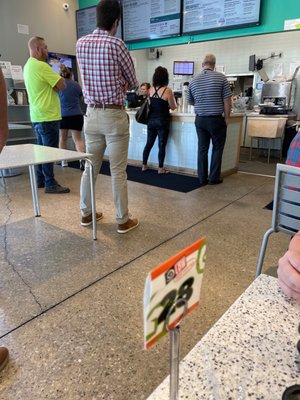
Find the location of a particular element. The width and height of the screenshot is (300, 400). cups is located at coordinates tap(184, 101).